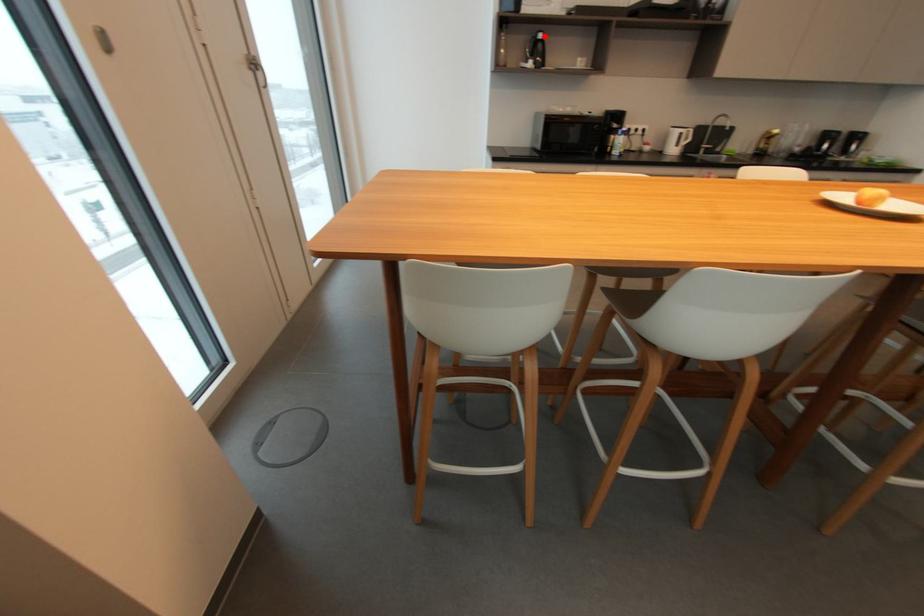
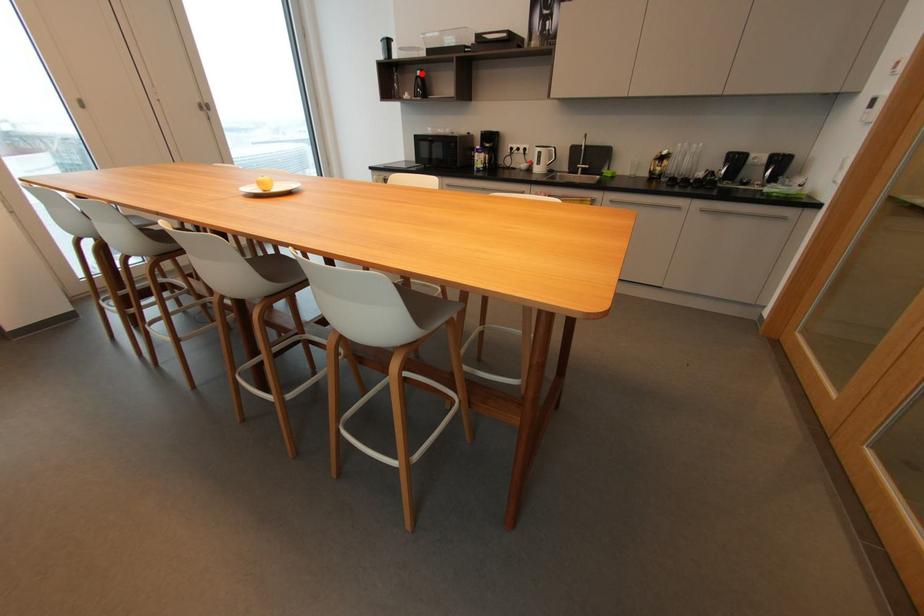
I am providing you with two images of the same scene from different viewpoints. A red point is marked on the first image and another point is marked on the second image. Does the point marked in image1 correspond to the same location as the one in image2?

Yes